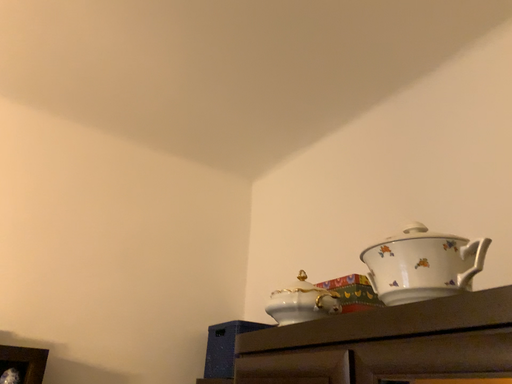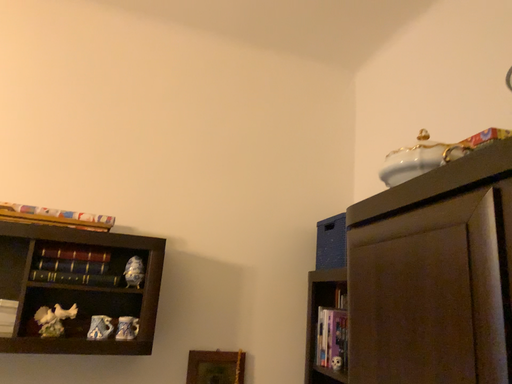
Question: How did the camera likely rotate when shooting the video?

Choices:
 (A) rotated upward
 (B) rotated downward

Answer: (B)